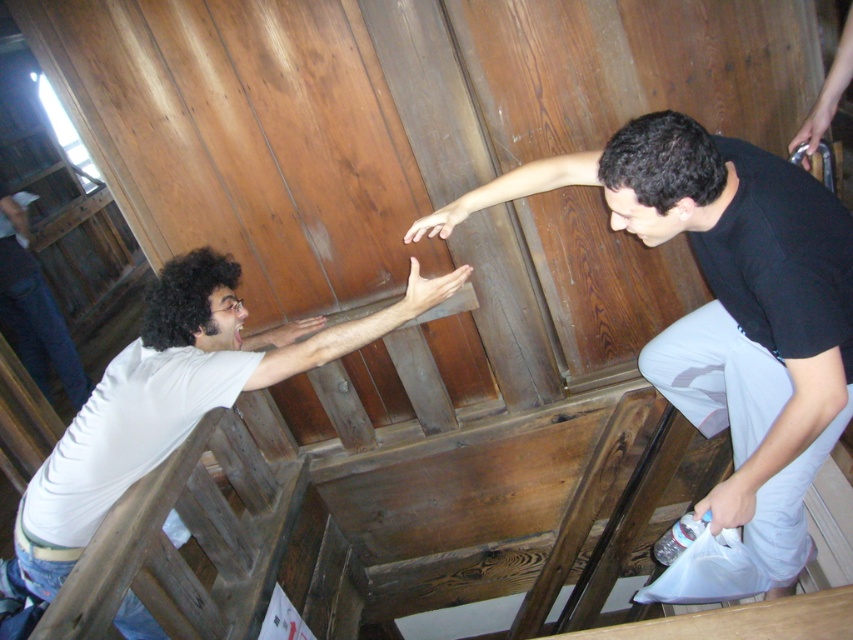
You are a photographer trying to capture both individuals in the scene. Since you want to ensure that both the white matte shirt at left and the white matte shirt at lower left are clearly visible, which shirt should you adjust the camera focus on first to account for their sizes?

The white matte shirt at left is bigger than the white matte shirt at lower left, so you should focus on the white matte shirt at left first since it is larger and might require more detailed focus to capture its features clearly.

Based on the scene described, which person is wearing a wider shirt, the black matte shirt at upper right or the white matte shirt at lower left?

The black matte shirt at upper right is wider than the white matte shirt at lower left according to the description.

You are standing in a rustic wooden cabin and see two people. The person wearing the black matte shirt at upper right is reaching towards the person in the white matte shirt at left. Can you determine which person is closer to you based on their positions?

The black matte shirt at upper right is positioned over the white matte shirt at left, meaning the person in the black matte shirt at upper right is closer to you.